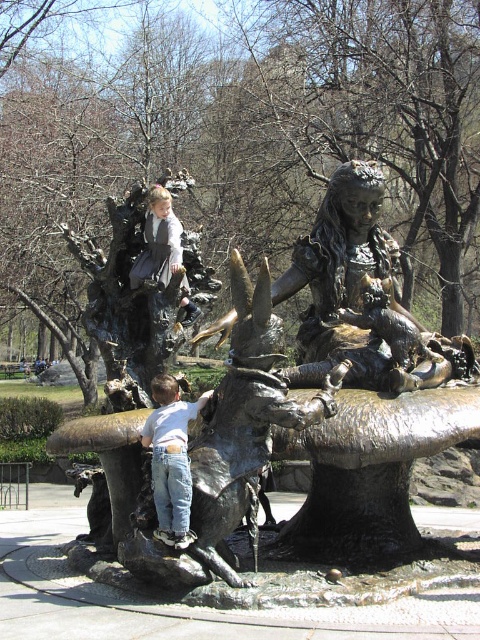
Question: Can you confirm if bronze statue at center is smaller than matte bronze statue at center?

Choices:
 (A) yes
 (B) no

Answer: (B)

Question: Which point is closer to the camera?

Choices:
 (A) white matte shirt at lower center
 (B) matte bronze statue at center

Answer: (A)

Question: Which point appears farthest from the camera in this image?

Choices:
 (A) (177, 476)
 (B) (156, 550)
 (C) (183, 310)

Answer: (C)

Question: Is bronze statue at center above white matte shirt at lower center?

Choices:
 (A) yes
 (B) no

Answer: (A)

Question: Among these objects, which one is farthest from the camera?

Choices:
 (A) bronze statue at center
 (B) matte bronze statue at center

Answer: (B)

Question: Can you confirm if bronze statue at center is positioned to the right of matte bronze statue at center?

Choices:
 (A) no
 (B) yes

Answer: (B)